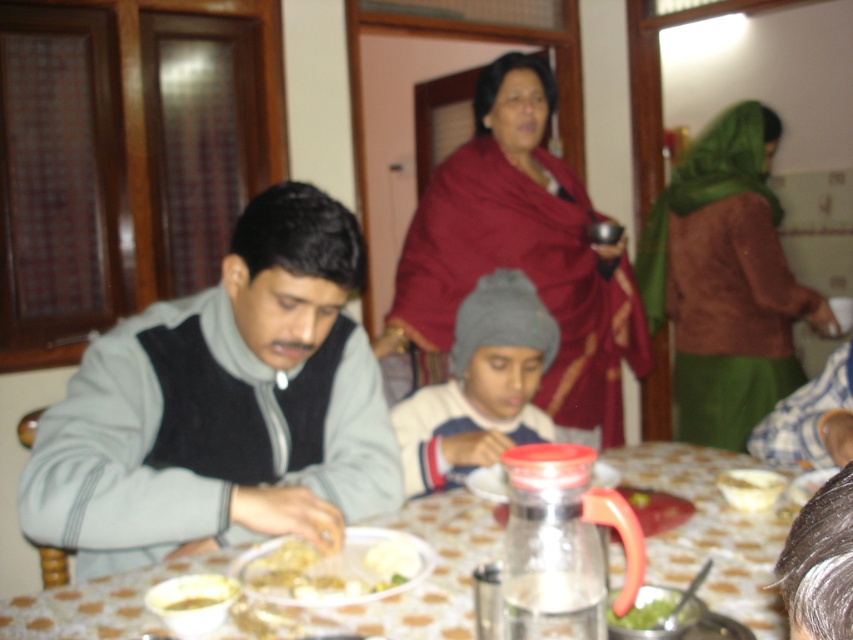
You are a guest at this family meal. You need to place your gray fleece jacket at center on the table. Where exactly should you put it?

The gray fleece jacket at center should be placed at the coordinates point (223, 404) on the table.

In the family meal setting, you see a white creamy rice at lower center and a green leafy vegetable at lower center on the table. Which of these two items is positioned more to the left?

The white creamy rice at lower center is positioned more to the left than the green leafy vegetable at lower center.